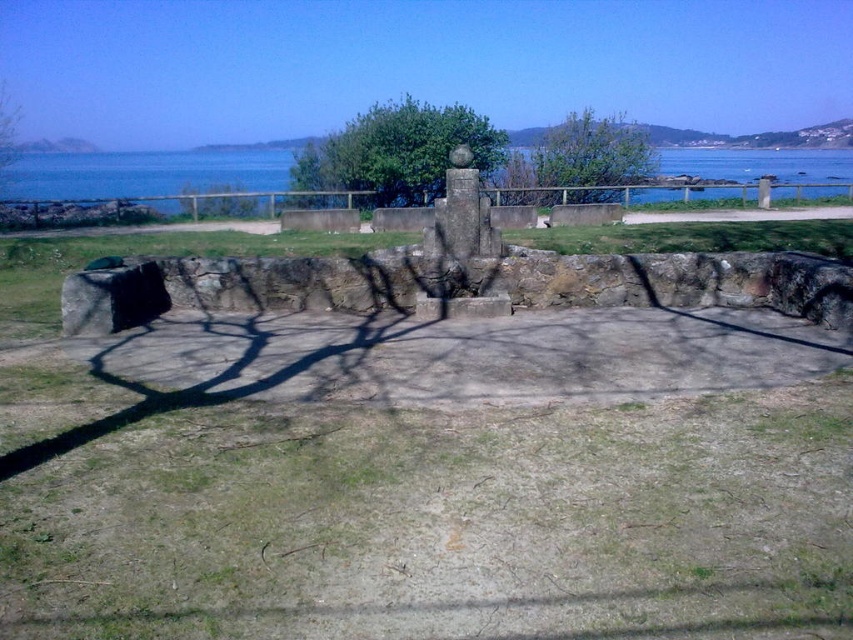
You are a landscape architect designing a walking path between the blue water at upper center and the green leafy tree at center. The path must be 5 meters long. Can you fit the path between them?

The distance between the blue water at upper center and the green leafy tree at center is 5.10 meters, so a 5 meter path can fit between them.

You are standing at the stone structure and want to walk towards the green leafy tree at upper center. Which direction should you face to see the green leafy tree at center in your left side?

The green leafy tree at center is to the left of the green leafy tree at upper center. So, if you face the green leafy tree at upper center, the green leafy tree at center will be on your left side.